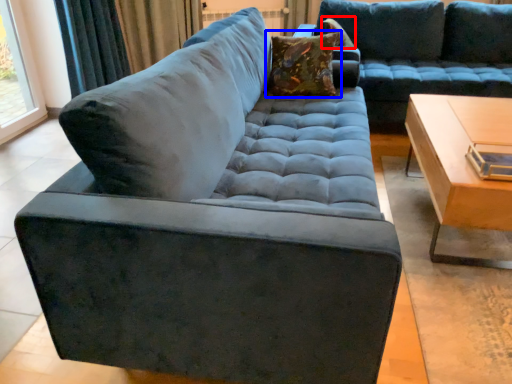
Question: Which point is further to the camera, pillow (highlighted by a red box) or pillow (highlighted by a blue box)?

Choices:
 (A) pillow
 (B) pillow

Answer: (A)